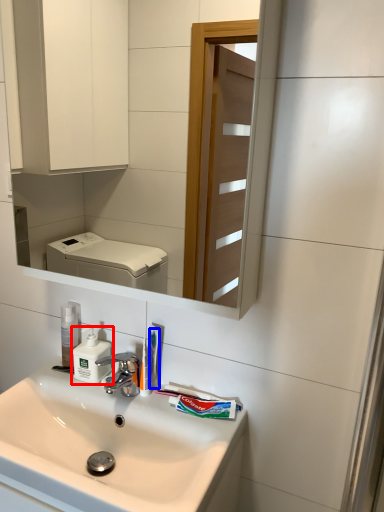
Question: Which of the following is the farthest to the observer, soap dispenser (highlighted by a red box) or toothbrush (highlighted by a blue box)?

Choices:
 (A) soap dispenser
 (B) toothbrush

Answer: (A)